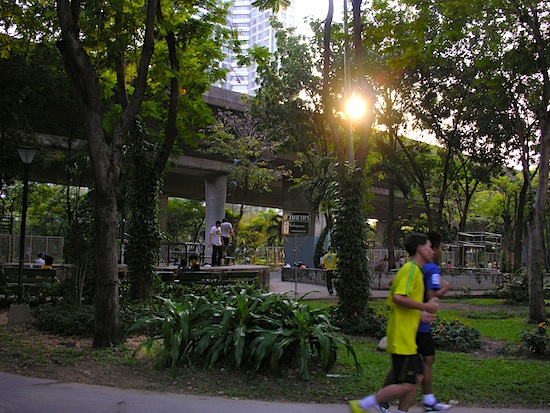
Find the location of a particular element. The image size is (550, 413). green plants is located at coordinates (254, 318).